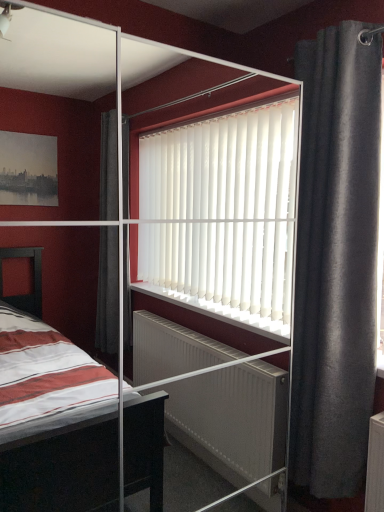
Question: From the image's perspective, is dark gray fabric curtain at right above or below transparent glass screen door at center?

Choices:
 (A) above
 (B) below

Answer: (A)

Question: Would you say dark gray fabric curtain at right is to the left or to the right of transparent glass screen door at center in the picture?

Choices:
 (A) left
 (B) right

Answer: (B)

Question: Relative to transparent glass screen door at center, is dark gray fabric curtain at right in front or behind?

Choices:
 (A) front
 (B) behind

Answer: (B)

Question: Would you say transparent glass screen door at center is to the left or to the right of dark gray fabric curtain at right in the picture?

Choices:
 (A) left
 (B) right

Answer: (A)

Question: Considering the positions of point (271, 93) and point (367, 334), is point (271, 93) closer or farther from the camera than point (367, 334)?

Choices:
 (A) closer
 (B) farther

Answer: (B)

Question: In terms of width, does transparent glass screen door at center look wider or thinner when compared to dark gray fabric curtain at right?

Choices:
 (A) wide
 (B) thin

Answer: (A)

Question: From a real-world perspective, is transparent glass screen door at center above or below dark gray fabric curtain at right?

Choices:
 (A) above
 (B) below

Answer: (B)